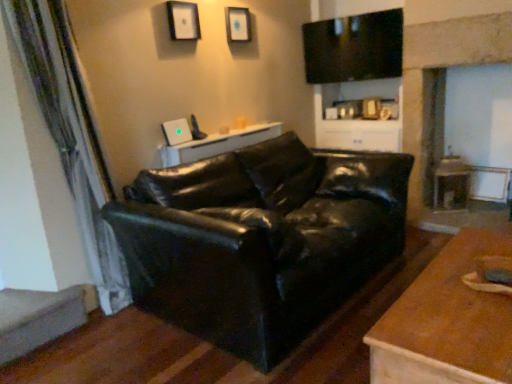
Question: In the image, is wooden coffee table at lower right, which appears as the first table when viewed from the right, positioned in front of or behind white glossy table at center, the 1th table viewed from the back?

Choices:
 (A) front
 (B) behind

Answer: (A)

Question: Considering the relative positions of wooden coffee table at lower right, the 2th table viewed from the top, and white glossy table at center, placed as the second table when sorted from front to back, in the image provided, is wooden coffee table at lower right, the 2th table viewed from the top, to the left or to the right of white glossy table at center, placed as the second table when sorted from front to back,?

Choices:
 (A) right
 (B) left

Answer: (A)

Question: Estimate the real-world distances between objects in this image. Which object is farther from the white glossy table at center, the 1th table viewed from the back?

Choices:
 (A) black leather couch at center
 (B) matte black picture frame at upper center, arranged as the 1th picture frame when viewed from the front
 (C) matte black entertainment center at upper center
 (D) green textured curtain at left
 (E) matte white picture frame at upper center, the second picture frame viewed from the front

Answer: (C)

Question: Based on their relative distances, which object is nearer to the matte black entertainment center at upper center?

Choices:
 (A) black leather couch at center
 (B) green textured curtain at left
 (C) wooden side table at right
 (D) matte white picture frame at upper center, positioned as the 1th picture frame in back-to-front order
 (E) wooden coffee table at lower right, the first table when ordered from bottom to top

Answer: (D)